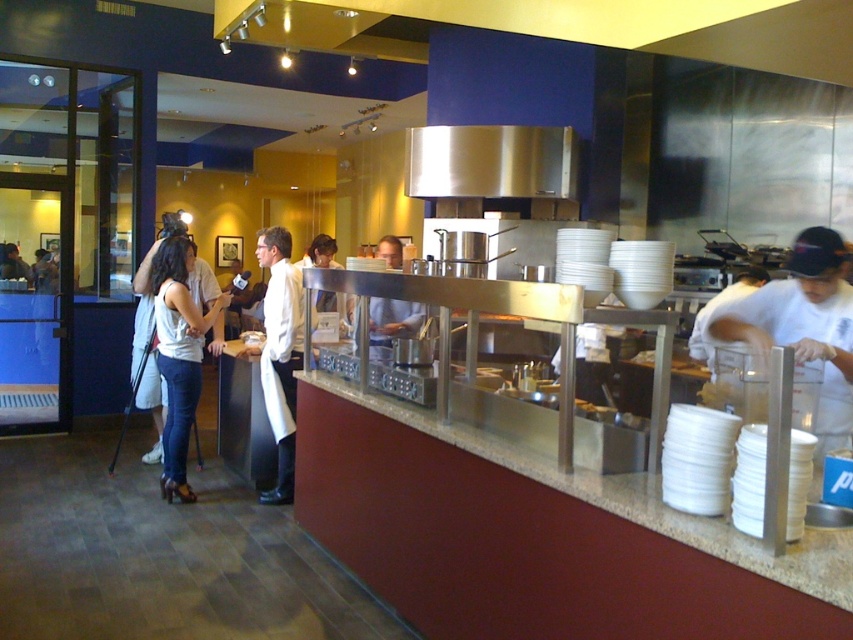
Question: Which object is the closest to the white chef coat at center?

Choices:
 (A) marble countertop at center
 (B) matte white blouse at center

Answer: (A)

Question: Does marble countertop at center have a lesser width compared to matte white blouse at center?

Choices:
 (A) yes
 (B) no

Answer: (B)

Question: Can you confirm if marble countertop at center is positioned to the right of white matte chef coat at center?

Choices:
 (A) yes
 (B) no

Answer: (A)

Question: Is marble countertop at center below white chef coat at center?

Choices:
 (A) no
 (B) yes

Answer: (B)

Question: Which object appears closest to the camera in this image?

Choices:
 (A) white chef coat at center
 (B) white matte shirt at right
 (C) white matte chef coat at center
 (D) marble countertop at center

Answer: (D)

Question: Among these objects, which one is nearest to the camera?

Choices:
 (A) white matte chef coat at center
 (B) white chef coat at center

Answer: (B)